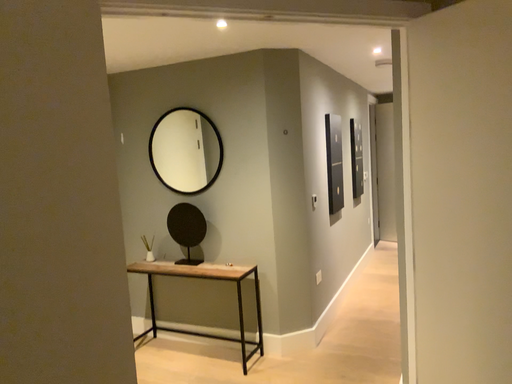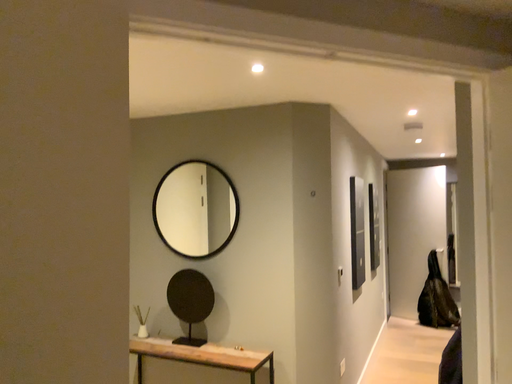
Question: Which way did the camera rotate in the video?

Choices:
 (A) rotated upward
 (B) rotated downward

Answer: (A)